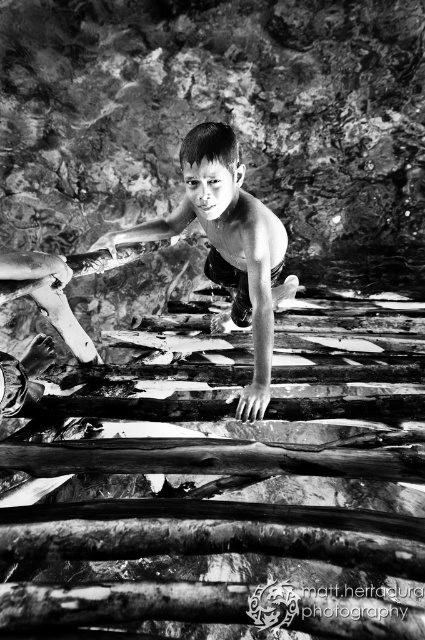
In the scene shown: Which is more to the right, rough wooden plank at center or smooth skin child at center?

Positioned to the right is rough wooden plank at center.

Is point (305, 452) closer to camera compared to point (229, 128)?

No, (305, 452) is behind (229, 128).

Locate an element on the screen. The height and width of the screenshot is (640, 425). rough wooden plank at center is located at coordinates (226, 499).